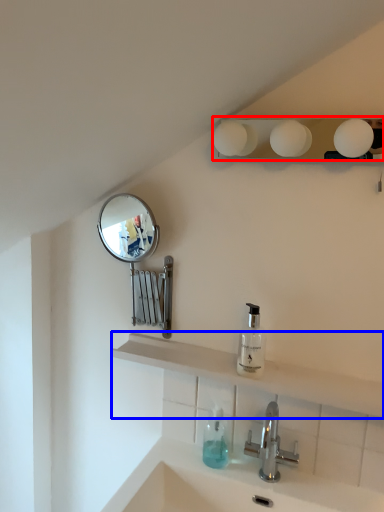
Question: Which of the following is the farthest to the observer, lighting (highlighted by a red box) or shelve (highlighted by a blue box)?

Choices:
 (A) lighting
 (B) shelve

Answer: (B)